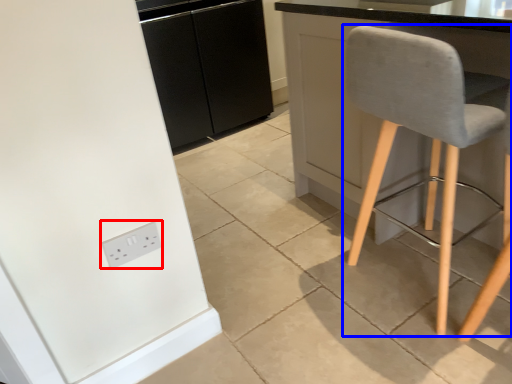
Question: Which of the following is the closest to the observer, socket (highlighted by a red box) or chair (highlighted by a blue box)?

Choices:
 (A) socket
 (B) chair

Answer: (B)